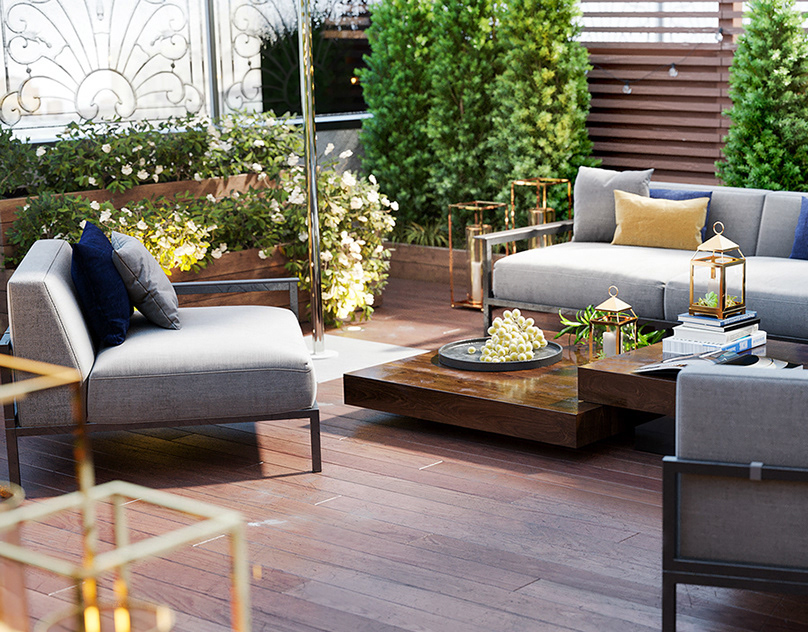
In order to click on table coffee wooden in this screenshot , I will do `click(543, 397)`, `click(616, 386)`.